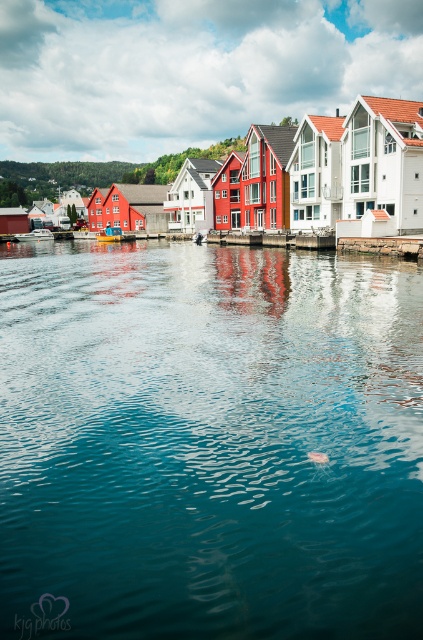
Question: Which object appears closest to the camera in this image?

Choices:
 (A) blue water at center
 (B) blue plastic boat at center

Answer: (A)

Question: Is blue water at center above white glossy boat at center?

Choices:
 (A) yes
 (B) no

Answer: (B)

Question: In this image, where is white glossy boat at center located relative to blue plastic boat at center?

Choices:
 (A) right
 (B) left

Answer: (B)

Question: Does blue water at center have a larger size compared to white glossy boat at center?

Choices:
 (A) no
 (B) yes

Answer: (B)

Question: Which object appears closest to the camera in this image?

Choices:
 (A) blue plastic boat at center
 (B) blue water at center

Answer: (B)

Question: Which object appears closest to the camera in this image?

Choices:
 (A) blue water at center
 (B) blue plastic boat at center
 (C) white glossy boat at center

Answer: (A)